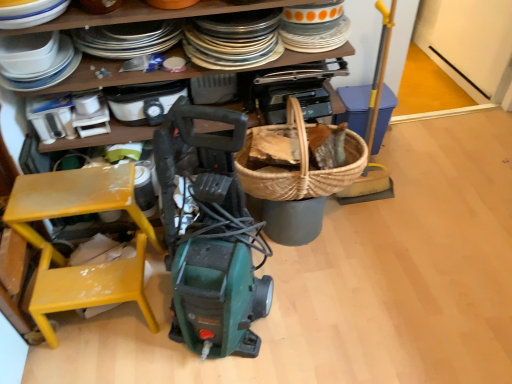
The width and height of the screenshot is (512, 384). I want to click on free space above green plastic vacuum cleaner at center (from a real-world perspective), so click(x=362, y=230).